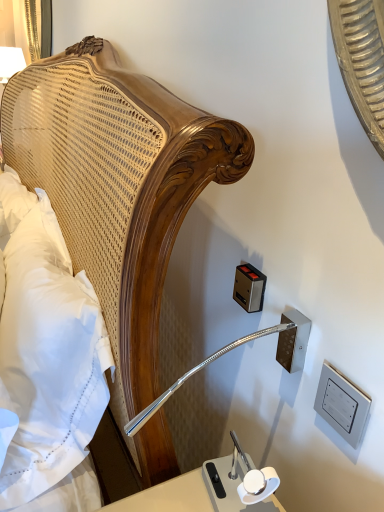
What do you see at coordinates (48, 358) in the screenshot? This screenshot has width=384, height=512. I see `white soft pillow at left` at bounding box center [48, 358].

Identify the location of metallic rectangular outlet at upper right, arranged as the 1th electric outlet when viewed from the left. This screenshot has height=512, width=384. (249, 288).

Which of these two, white soft pillow at left or metallic silver outlet at lower right, positioned as the first electric outlet in front-to-back order, is thinner?

Thinner between the two is metallic silver outlet at lower right, positioned as the first electric outlet in front-to-back order.

Find the location of a particular element. pillow below the metallic silver outlet at lower right, positioned as the first electric outlet in front-to-back order (from the image's perspective) is located at coordinates 48,358.

Is the surface of white soft pillow at left in direct contact with metallic silver outlet at lower right, positioned as the first electric outlet in front-to-back order?

They are not placed beside each other.

Is metallic rectangular outlet at upper right, arranged as the 1th electric outlet when viewed from the left, looking in the opposite direction of metallic silver outlet at lower right, positioned as the first electric outlet in right-to-left order?

That's not correct — metallic rectangular outlet at upper right, arranged as the 1th electric outlet when viewed from the left, is not looking away from metallic silver outlet at lower right, positioned as the first electric outlet in right-to-left order.

Does metallic rectangular outlet at upper right, the second electric outlet when ordered from front to back, have a lesser width compared to metallic silver outlet at lower right, which is the second electric outlet in left-to-right order?

In fact, metallic rectangular outlet at upper right, the second electric outlet when ordered from front to back, might be wider than metallic silver outlet at lower right, which is the second electric outlet in left-to-right order.

How different are the orientations of metallic rectangular outlet at upper right, the 1th electric outlet in the back-to-front sequence, and metallic silver outlet at lower right, the second electric outlet positioned from the back, in degrees?

The facing directions of metallic rectangular outlet at upper right, the 1th electric outlet in the back-to-front sequence, and metallic silver outlet at lower right, the second electric outlet positioned from the back, are 1.75 degrees apart.

Looking at this image, from a real-world perspective, is metallic rectangular outlet at upper right, the 1th electric outlet in the back-to-front sequence, positioned under metallic silver outlet at lower right, positioned as the first electric outlet in right-to-left order, based on gravity?

No, from a real-world perspective, metallic rectangular outlet at upper right, the 1th electric outlet in the back-to-front sequence, is not beneath metallic silver outlet at lower right, positioned as the first electric outlet in right-to-left order.

From a real-world perspective, between metallic silver outlet at lower right, positioned as the first electric outlet in front-to-back order, and metallic rectangular outlet at upper right, the second electric outlet when ordered from front to back, who is vertically higher?

metallic rectangular outlet at upper right, the second electric outlet when ordered from front to back, is physically above.

Between metallic silver outlet at lower right, positioned as the first electric outlet in front-to-back order, and metallic rectangular outlet at upper right, which ranks as the 2th electric outlet in right-to-left order, which one is positioned behind?

metallic rectangular outlet at upper right, which ranks as the 2th electric outlet in right-to-left order, is more distant.

Considering the relative positions of metallic silver outlet at lower right, positioned as the first electric outlet in front-to-back order, and metallic rectangular outlet at upper right, the 1th electric outlet in the back-to-front sequence, in the image provided, is metallic silver outlet at lower right, positioned as the first electric outlet in front-to-back order, to the right of metallic rectangular outlet at upper right, the 1th electric outlet in the back-to-front sequence, from the viewer's perspective?

Indeed, metallic silver outlet at lower right, positioned as the first electric outlet in front-to-back order, is positioned on the right side of metallic rectangular outlet at upper right, the 1th electric outlet in the back-to-front sequence.

At what (x,y) coordinates should I click in order to perform the action: click on electric outlet that appears above the metallic silver outlet at lower right, positioned as the first electric outlet in front-to-back order (from a real-world perspective). Please return your answer as a coordinate pair (x, y). The image size is (384, 512). Looking at the image, I should click on click(249, 288).

Locate an element on the screen. the 1st electric outlet to the right when counting from the white soft pillow at left is located at coordinates pos(249,288).

Could you tell me if white soft pillow at left is turned towards metallic rectangular outlet at upper right, which ranks as the 2th electric outlet in right-to-left order?

No, white soft pillow at left is not turned towards metallic rectangular outlet at upper right, which ranks as the 2th electric outlet in right-to-left order.

From the image's perspective, is white soft pillow at left positioned above or below metallic rectangular outlet at upper right, arranged as the 1th electric outlet when viewed from the left?

From the image's perspective, white soft pillow at left appears below metallic rectangular outlet at upper right, arranged as the 1th electric outlet when viewed from the left.

Is white soft pillow at left bigger or smaller than metallic rectangular outlet at upper right, the 1th electric outlet in the back-to-front sequence?

In the image, white soft pillow at left appears to be larger than metallic rectangular outlet at upper right, the 1th electric outlet in the back-to-front sequence.

Considering the sizes of objects metallic silver outlet at lower right, positioned as the first electric outlet in right-to-left order, and white soft pillow at left in the image provided, who is shorter, metallic silver outlet at lower right, positioned as the first electric outlet in right-to-left order, or white soft pillow at left?

With less height is metallic silver outlet at lower right, positioned as the first electric outlet in right-to-left order.

Which is more to the right, metallic silver outlet at lower right, the second electric outlet positioned from the back, or white soft pillow at left?

From the viewer's perspective, metallic silver outlet at lower right, the second electric outlet positioned from the back, appears more on the right side.

Between metallic silver outlet at lower right, the second electric outlet positioned from the back, and white soft pillow at left, which one has larger width?

white soft pillow at left.

Could you tell me if metallic rectangular outlet at upper right, the second electric outlet when ordered from front to back, is turned towards white soft pillow at left?

Yes, metallic rectangular outlet at upper right, the second electric outlet when ordered from front to back, is oriented towards white soft pillow at left.

Which is closer, (262, 296) or (75, 362)?

Point (262, 296) is positioned closer to the camera compared to point (75, 362).

Looking at this image, is metallic rectangular outlet at upper right, the 1th electric outlet in the back-to-front sequence, at the right side of white soft pillow at left?

Yes.

From a real-world perspective, between metallic rectangular outlet at upper right, the second electric outlet when ordered from front to back, and white soft pillow at left, who is vertically lower?

In real-world perspective, white soft pillow at left is lower.

From the image's perspective, starting from the white soft pillow at left, which electric outlet is the 1st one above? Please provide its 2D coordinates.

[(293, 341)]

There is a metallic silver outlet at lower right, positioned as the first electric outlet in front-to-back order. Where is `electric outlet above it (from a real-world perspective)`? electric outlet above it (from a real-world perspective) is located at coordinates (249, 288).

Based on their spatial positions, is metallic rectangular outlet at upper right, arranged as the 1th electric outlet when viewed from the left, or metallic silver outlet at lower right, which is the second electric outlet in left-to-right order, closer to white soft pillow at left?

Based on the image, metallic rectangular outlet at upper right, arranged as the 1th electric outlet when viewed from the left, appears to be nearer to white soft pillow at left.

Estimate the real-world distances between objects in this image. Which object is further from metallic silver outlet at lower right, positioned as the first electric outlet in front-to-back order, metallic rectangular outlet at upper right, the 1th electric outlet in the back-to-front sequence, or white soft pillow at left?

white soft pillow at left is further to metallic silver outlet at lower right, positioned as the first electric outlet in front-to-back order.

When comparing their distances from metallic rectangular outlet at upper right, the 1th electric outlet in the back-to-front sequence, does metallic silver outlet at lower right, positioned as the first electric outlet in front-to-back order, or white soft pillow at left seem closer?

metallic silver outlet at lower right, positioned as the first electric outlet in front-to-back order.

Looking at the image, which one is located closer to metallic rectangular outlet at upper right, which ranks as the 2th electric outlet in right-to-left order, white soft pillow at left or metallic silver outlet at lower right, the second electric outlet positioned from the back?

metallic silver outlet at lower right, the second electric outlet positioned from the back, is positioned closer to the anchor metallic rectangular outlet at upper right, which ranks as the 2th electric outlet in right-to-left order.

Which object lies nearer to the anchor point metallic silver outlet at lower right, positioned as the first electric outlet in front-to-back order, white soft pillow at left or metallic rectangular outlet at upper right, which ranks as the 2th electric outlet in right-to-left order?

Among the two, metallic rectangular outlet at upper right, which ranks as the 2th electric outlet in right-to-left order, is located nearer to metallic silver outlet at lower right, positioned as the first electric outlet in front-to-back order.

Which object lies nearer to the anchor point white soft pillow at left, metallic silver outlet at lower right, positioned as the first electric outlet in right-to-left order, or metallic rectangular outlet at upper right, arranged as the 1th electric outlet when viewed from the left?

Based on the image, metallic rectangular outlet at upper right, arranged as the 1th electric outlet when viewed from the left, appears to be nearer to white soft pillow at left.

Where is `electric outlet located between white soft pillow at left and metallic silver outlet at lower right, positioned as the first electric outlet in front-to-back order, in the left-right direction`? Image resolution: width=384 pixels, height=512 pixels. electric outlet located between white soft pillow at left and metallic silver outlet at lower right, positioned as the first electric outlet in front-to-back order, in the left-right direction is located at coordinates (249, 288).